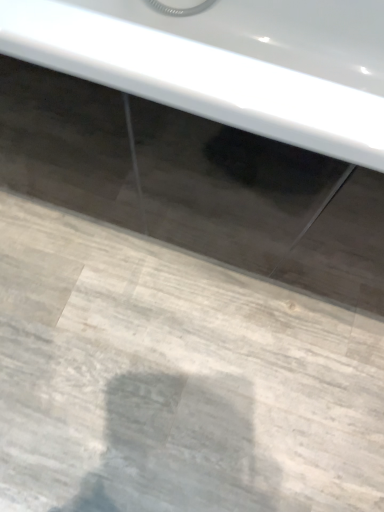
Measure the distance between white glossy bathtub at upper center and camera.

35.16 inches.

Where is `white glossy bathtub at upper center`? The height and width of the screenshot is (512, 384). white glossy bathtub at upper center is located at coordinates (227, 63).

What do you see at coordinates (227, 63) in the screenshot?
I see `white glossy bathtub at upper center` at bounding box center [227, 63].

The height and width of the screenshot is (512, 384). Find the location of `white glossy bathtub at upper center`. white glossy bathtub at upper center is located at coordinates (227, 63).